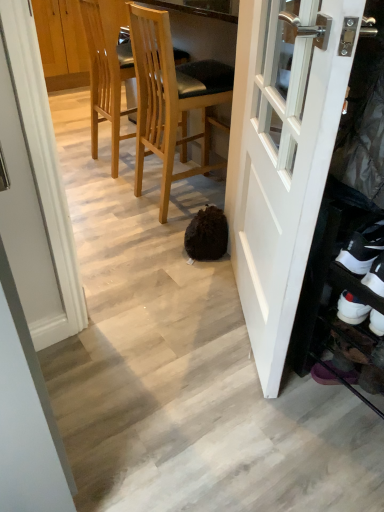
Find the location of `free space in front of white glossy door at right`. free space in front of white glossy door at right is located at coordinates (246, 437).